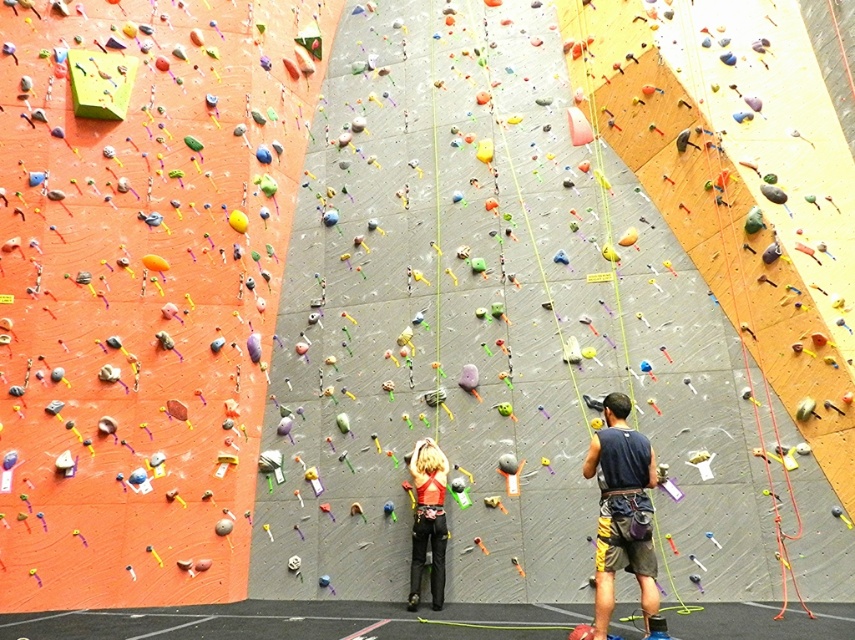
You are a climber preparing to ascend the climbing wall and notice the dark blue tank top at center and the matte red harness at center. Which clothing item is covering the other?

The dark blue tank top at center is positioned over the matte red harness at center, so it is covering the matte red harness at center.

You are a rock climbing instructor observing the climbers at the base of the wall. You notice the dark blue tank top at center and the matte red harness at center. Which object is taller?

The dark blue tank top at center is taller than the matte red harness at center.

You are planning to set up a safety harness anchor point for the climber wearing the dark blue tank top at center. Based on their position, where should you place the anchor in relation to their current location?

The dark blue tank top at center is located at point (622,509), so the anchor should be placed directly above this coordinate to ensure proper support during the climb.